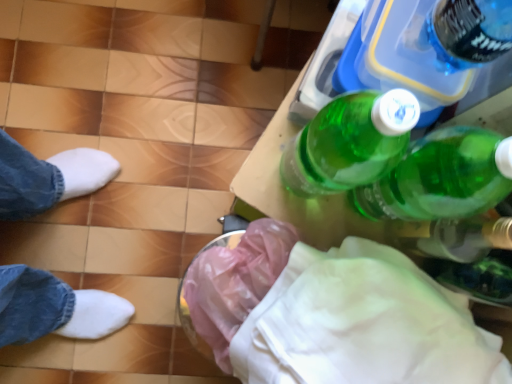
Question: Based on their sizes in the image, would you say green plastic bottle at upper right is bigger or smaller than pink plastic bag at lower center?

Choices:
 (A) big
 (B) small

Answer: (A)

Question: From a real-world perspective, relative to pink plastic bag at lower center, is green plastic bottle at upper right vertically above or below?

Choices:
 (A) below
 (B) above

Answer: (B)

Question: Based on their relative distances, which object is nearer to the transparent plastic bottle at lower right?

Choices:
 (A) green plastic bottle at upper right
 (B) white fabric at lower right
 (C) pink plastic bag at lower center

Answer: (B)

Question: Which object is positioned closest to the pink plastic bag at lower center?

Choices:
 (A) green plastic bottle at upper right
 (B) white fabric at lower right
 (C) transparent plastic bottle at lower right

Answer: (B)